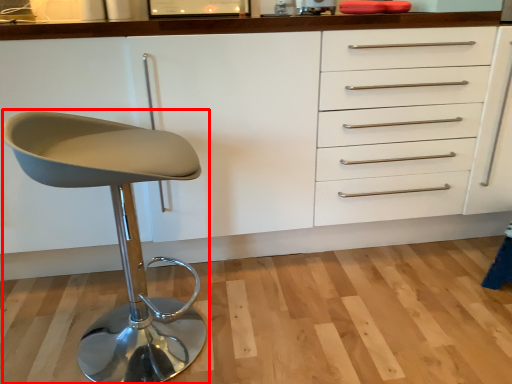
Question: From the image's perspective, where is chair (annotated by the red box) located in relation to cabinetry in the image?

Choices:
 (A) below
 (B) above

Answer: (A)